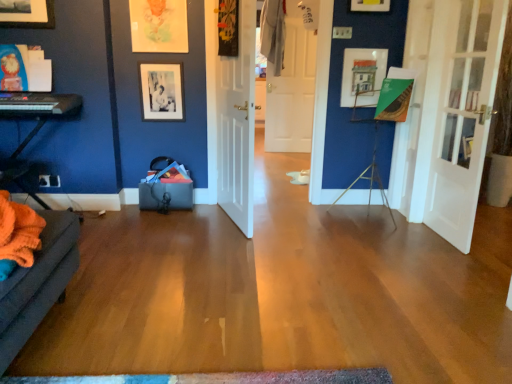
Image resolution: width=512 pixels, height=384 pixels. What are the coordinates of `unoccupied area behind multicolored woven mat at lower center` in the screenshot? It's located at (219, 306).